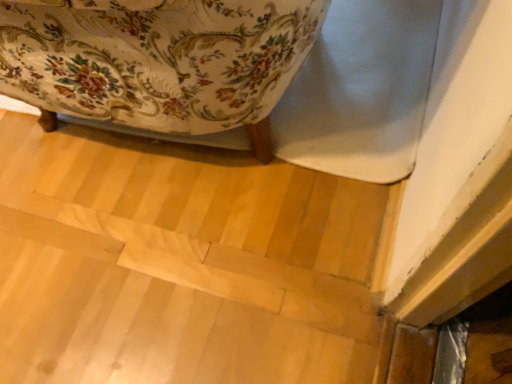
The image size is (512, 384). Describe the element at coordinates (157, 60) in the screenshot. I see `floral fabric sofa at lower left` at that location.

The height and width of the screenshot is (384, 512). In order to click on floral fabric sofa at lower left in this screenshot , I will do `click(157, 60)`.

Find the location of `floral fabric sofa at lower left`. floral fabric sofa at lower left is located at coordinates (157, 60).